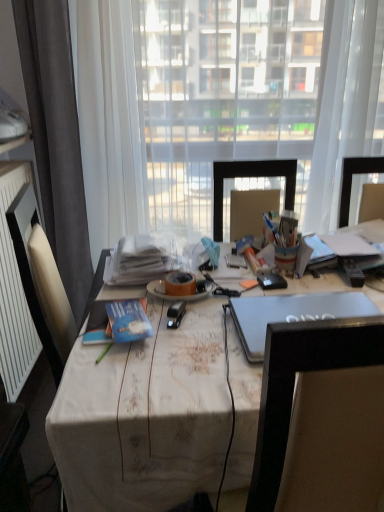
Question: Does white paper stack at center, the second book in the front-to-back sequence, have a lesser width compared to white textured radiator at left?

Choices:
 (A) yes
 (B) no

Answer: (B)

Question: Can you confirm if white paper stack at center, marked as the second book in a bottom-to-top arrangement, is bigger than white textured radiator at left?

Choices:
 (A) yes
 (B) no

Answer: (B)

Question: Is there a large distance between white paper stack at center, the second book in the front-to-back sequence, and white textured radiator at left?

Choices:
 (A) no
 (B) yes

Answer: (A)

Question: Is white paper stack at center, positioned as the first book in top-to-bottom order, smaller than white textured radiator at left?

Choices:
 (A) yes
 (B) no

Answer: (A)

Question: From the image's perspective, is white paper stack at center, the first book from the back, over white textured radiator at left?

Choices:
 (A) yes
 (B) no

Answer: (A)

Question: Considering the relative sizes of white paper stack at center, the second book in the front-to-back sequence, and white textured radiator at left in the image provided, is white paper stack at center, the second book in the front-to-back sequence, shorter than white textured radiator at left?

Choices:
 (A) yes
 (B) no

Answer: (A)

Question: Is white fabric-covered desk at center aimed at sleek silver laptop at center?

Choices:
 (A) no
 (B) yes

Answer: (A)

Question: Is white fabric-covered desk at center with sleek silver laptop at center?

Choices:
 (A) yes
 (B) no

Answer: (B)

Question: Is white fabric-covered desk at center not inside sleek silver laptop at center?

Choices:
 (A) yes
 (B) no

Answer: (A)

Question: Considering the relative sizes of white fabric-covered desk at center and sleek silver laptop at center in the image provided, is white fabric-covered desk at center taller than sleek silver laptop at center?

Choices:
 (A) yes
 (B) no

Answer: (A)

Question: Considering the relative positions of white fabric-covered desk at center and sleek silver laptop at center in the image provided, is white fabric-covered desk at center behind sleek silver laptop at center?

Choices:
 (A) yes
 (B) no

Answer: (B)

Question: Is white fabric-covered desk at center at the left side of sleek silver laptop at center?

Choices:
 (A) no
 (B) yes

Answer: (B)

Question: Is white textured radiator at left looking in the opposite direction of transparent fabric at center?

Choices:
 (A) no
 (B) yes

Answer: (A)